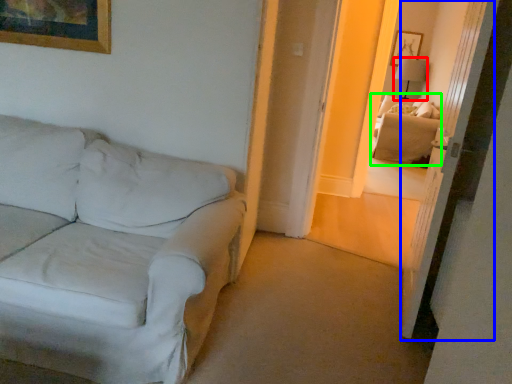
Question: Considering the real-world distances, which object is farthest from table lamp (highlighted by a red box)? glass door (highlighted by a blue box) or couch (highlighted by a green box)?

Choices:
 (A) glass door
 (B) couch

Answer: (A)